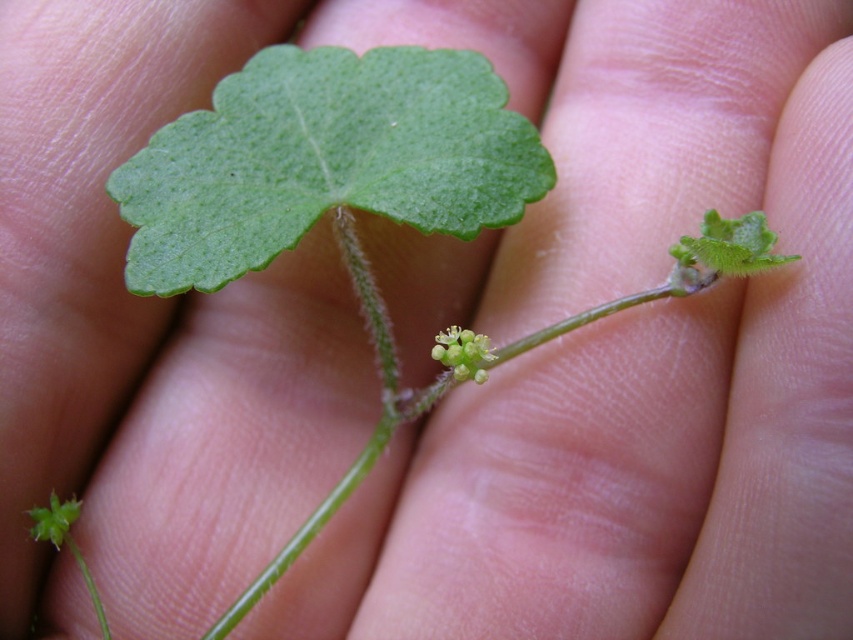
Can you confirm if green matte leaf at center is wider than green matte flower at center?

Yes, green matte leaf at center is wider than green matte flower at center.

This screenshot has height=640, width=853. What are the coordinates of `green matte leaf at center` in the screenshot? It's located at (323, 161).

Where is `green matte leaf at center`? Image resolution: width=853 pixels, height=640 pixels. green matte leaf at center is located at coordinates (323, 161).